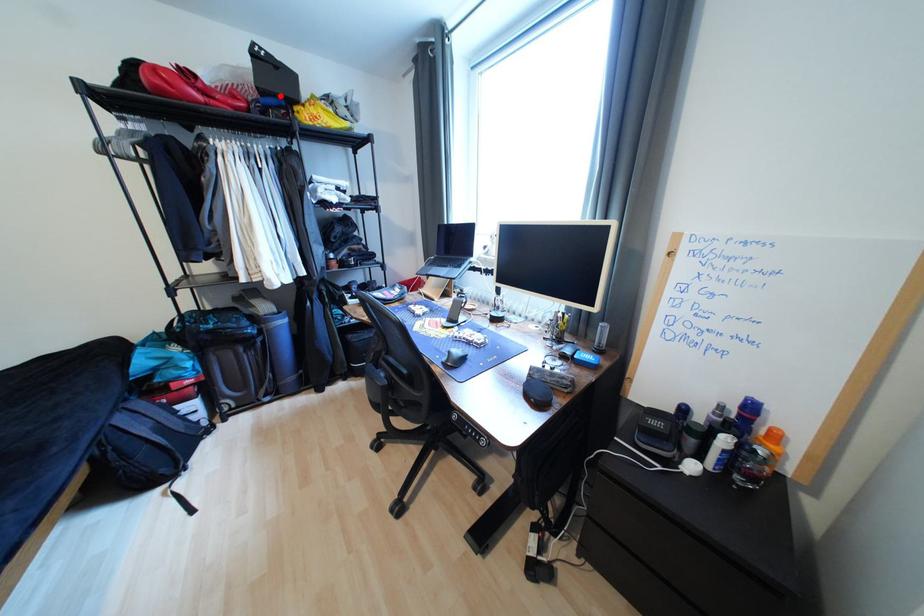
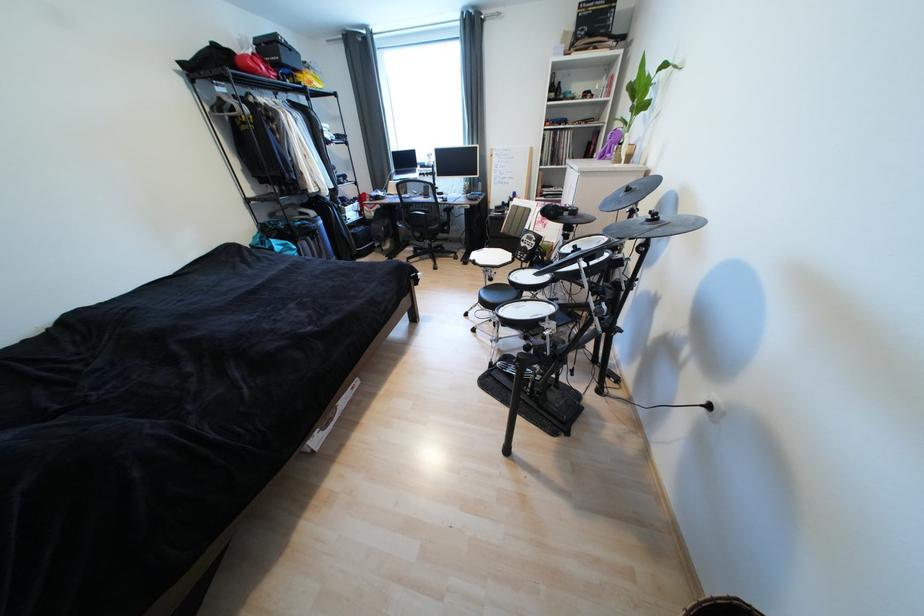
In the second image, find the point that corresponds to the highlighted location in the first image.

(294, 68)